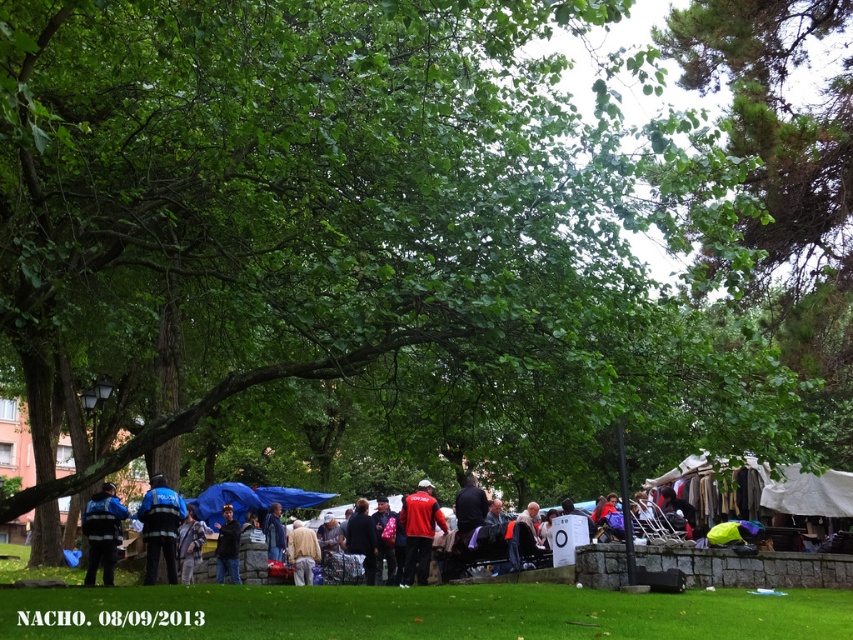
Question: Considering the relative positions of dark blue jacket at center and blue fabric umbrella at center in the image provided, where is dark blue jacket at center located with respect to blue fabric umbrella at center?

Choices:
 (A) below
 (B) above

Answer: (B)

Question: Which point is farther to the camera?

Choices:
 (A) (368, 522)
 (B) (183, 554)
 (C) (357, 605)

Answer: (A)

Question: Can you confirm if dark blue jacket at center is positioned above blue fabric umbrella at center?

Choices:
 (A) yes
 (B) no

Answer: (A)

Question: Does light beige fabric at center have a lesser width compared to dark blue jacket at center?

Choices:
 (A) no
 (B) yes

Answer: (B)

Question: Among these points, which one is farthest from the camera?

Choices:
 (A) (352, 552)
 (B) (67, 627)
 (C) (161, 515)
 (D) (100, 506)

Answer: (A)

Question: Which object is positioned farthest from the dark blue jacket at center?

Choices:
 (A) blue fabric umbrella at center
 (B) dark blue fabric at center
 (C) green grass at lower center

Answer: (C)